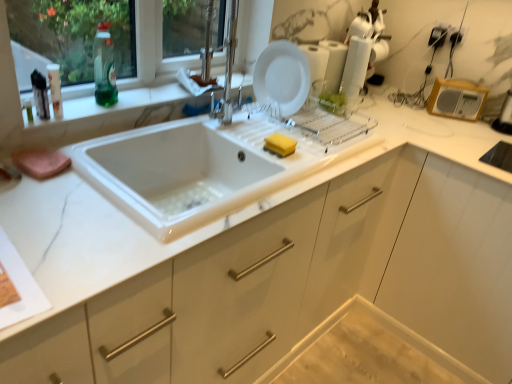
Identify the location of free space in front of yellow sponge at sink. The height and width of the screenshot is (384, 512). (282, 172).